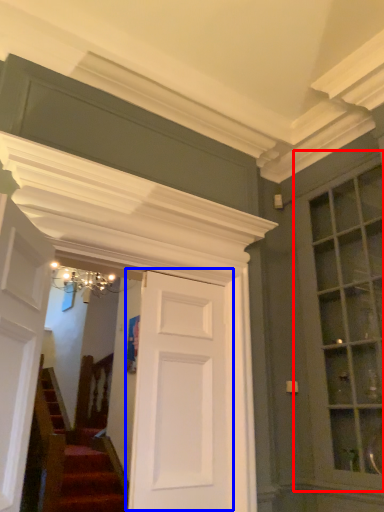
Question: Among these objects, which one is farthest to the camera, window (highlighted by a red box) or door (highlighted by a blue box)?

Choices:
 (A) window
 (B) door

Answer: (A)